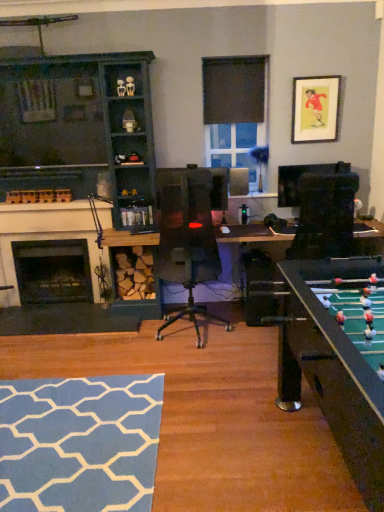
Question: Should I look upward or downward to see blue fabric rug at lower left?

Choices:
 (A) up
 (B) down

Answer: (B)

Question: Is the surface of black fabric curtain at upper center in direct contact with blue fabric rug at lower left?

Choices:
 (A) yes
 (B) no

Answer: (B)

Question: Can blue fabric rug at lower left be found inside black fabric curtain at upper center?

Choices:
 (A) no
 (B) yes

Answer: (A)

Question: Is black fabric curtain at upper center positioned behind blue fabric rug at lower left?

Choices:
 (A) yes
 (B) no

Answer: (A)

Question: Can you confirm if black fabric curtain at upper center is smaller than blue fabric rug at lower left?

Choices:
 (A) no
 (B) yes

Answer: (B)

Question: Can you confirm if black fabric curtain at upper center is thinner than blue fabric rug at lower left?

Choices:
 (A) no
 (B) yes

Answer: (B)

Question: Is black fabric curtain at upper center far from blue fabric rug at lower left?

Choices:
 (A) no
 (B) yes

Answer: (B)

Question: Is clear glass window at center further to the viewer compared to blue fabric rug at lower left?

Choices:
 (A) yes
 (B) no

Answer: (A)

Question: Considering the relative sizes of clear glass window at center and blue fabric rug at lower left in the image provided, is clear glass window at center taller than blue fabric rug at lower left?

Choices:
 (A) no
 (B) yes

Answer: (B)

Question: Is clear glass window at center directly adjacent to blue fabric rug at lower left?

Choices:
 (A) yes
 (B) no

Answer: (B)

Question: Does clear glass window at center appear on the right side of blue fabric rug at lower left?

Choices:
 (A) no
 (B) yes

Answer: (B)

Question: Considering the relative positions of clear glass window at center and blue fabric rug at lower left in the image provided, is clear glass window at center in front of blue fabric rug at lower left?

Choices:
 (A) yes
 (B) no

Answer: (B)

Question: Is blue fabric rug at lower left located within clear glass window at center?

Choices:
 (A) no
 (B) yes

Answer: (A)

Question: Does dark wood cabinet at left have a larger size compared to black matte fireplace at left, the 2th fireplace positioned from the front?

Choices:
 (A) yes
 (B) no

Answer: (A)